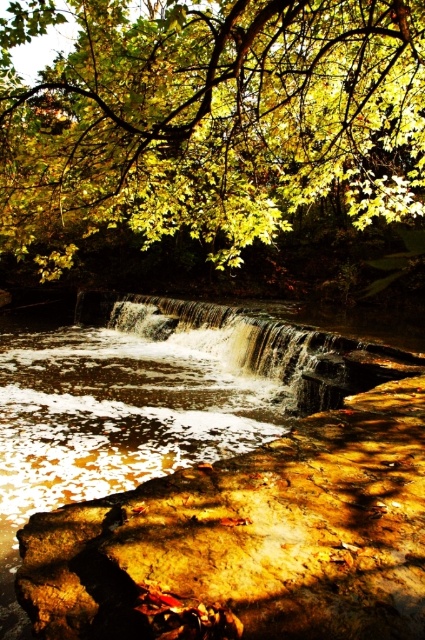
Can you confirm if yellow/golden leaves at upper center is smaller than golden textured water at center?

No.

Between yellow/golden leaves at upper center and golden textured water at center, which one has less height?

Standing shorter between the two is golden textured water at center.

Is point (283, 120) positioned behind point (241, 332)?

No, (283, 120) is closer to viewer.

Identify the location of yellow/golden leaves at upper center. (209, 120).